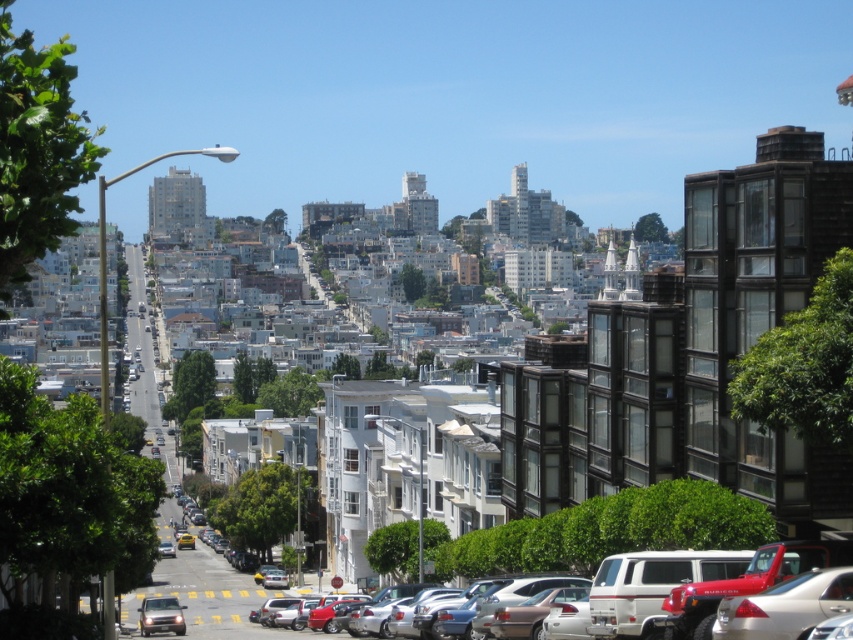
Can you confirm if metallic silver sedan at lower center is taller than shiny silver suv at lower left?

Result: Yes, metallic silver sedan at lower center is taller than shiny silver suv at lower left.

Is point (808, 547) farther from viewer compared to point (178, 621)?

No, it is in front of (178, 621).

Is point (602, 566) farther from viewer compared to point (144, 632)?

No, it is not.

I want to click on metallic silver sedan at lower center, so click(767, 570).